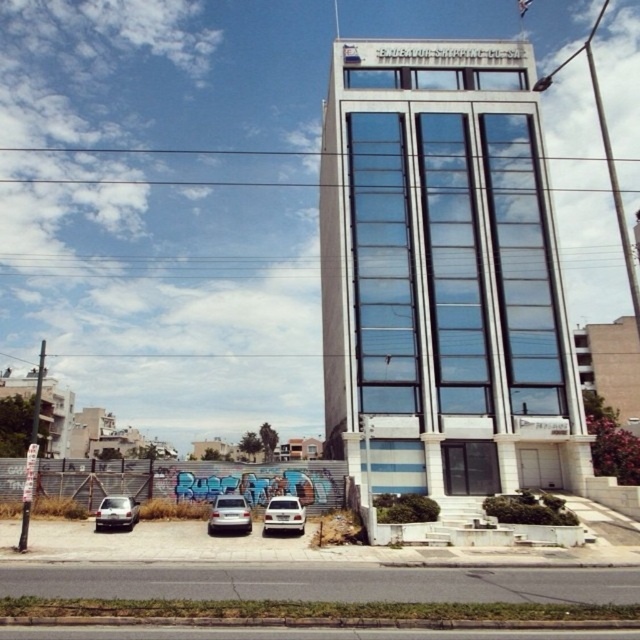
Question: Where is transparent glass building at center located in relation to satin silver car at lower center in the image?

Choices:
 (A) below
 (B) above

Answer: (B)

Question: Among these objects, which one is nearest to the camera?

Choices:
 (A) satin silver sedan at lower left
 (B) transparent glass building at center
 (C) satin silver suv at lower center
 (D) satin silver car at lower center

Answer: (C)

Question: Is satin silver car at lower center positioned before satin silver suv at lower center?

Choices:
 (A) yes
 (B) no

Answer: (B)

Question: Which point is closer to the camera taking this photo?

Choices:
 (A) (545, 337)
 (B) (132, 513)
 (C) (262, 532)
 (D) (212, 516)

Answer: (D)

Question: Is transparent glass building at center smaller than satin silver car at lower center?

Choices:
 (A) no
 (B) yes

Answer: (A)

Question: Which of the following is the closest to the observer?

Choices:
 (A) satin silver suv at lower center
 (B) satin silver car at lower center

Answer: (A)